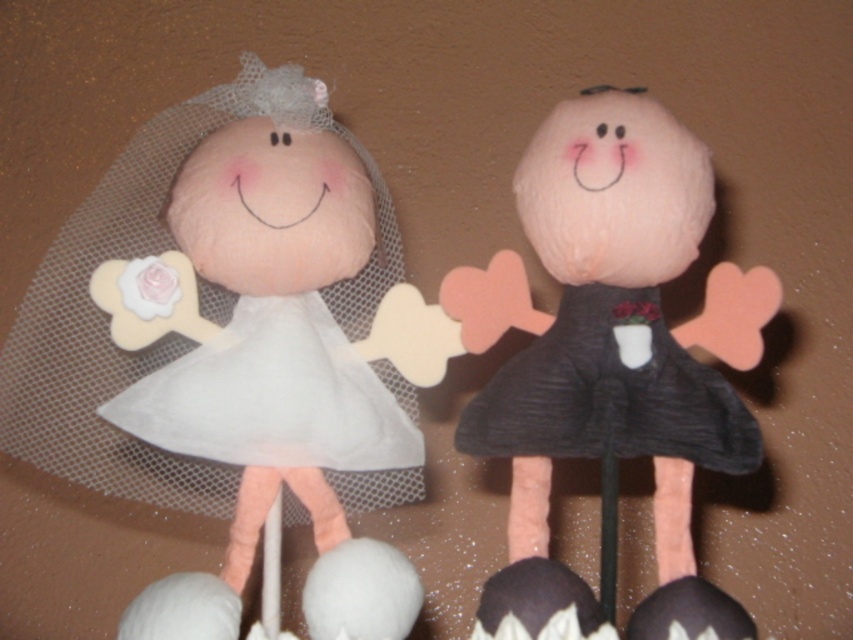
You are standing in front of the two dolls and want to place a small decoration between the dark gray textured dress at right and yourself. If the decoration requires at least 1 meter of space to be placed safely, will there be enough space?

The distance between the dark gray textured dress at right and the viewer is 97.29 centimeters, which is less than 1 meter. Therefore, there is not enough space to place the decoration safely.

You are a photographer adjusting your camera to focus on two points in the image. The first point is point (238,529) and the second is point (670,420). Which point is closer to your camera?

Point (238,529) is closer to the camera than point (670,420) because it is further to the viewer.

You are a collector of vintage dolls and have a display shelf that requires dolls to be arranged from top to bottom. You have the white fabric doll at left and the matte black dress at right. Based on their current positions in the image, which doll should you place higher on the shelf to match their arrangement?

The white fabric doll at left should be placed higher on the shelf since it is located above the matte black dress at right in the image.